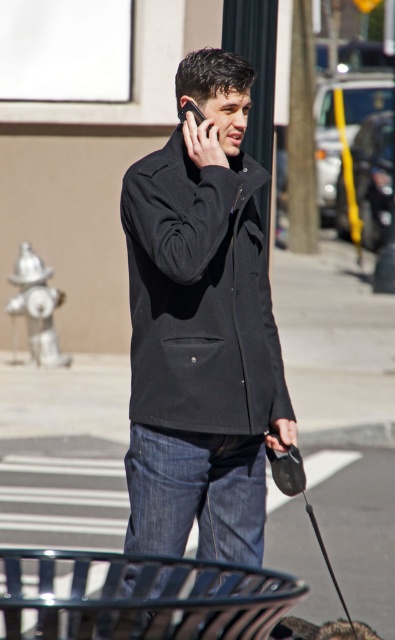
You are a delivery person who needs to deliver a package to the address on the tree trunk nearby. You see the black matte jacket at center and the silver metallic fire hydrant at lower left. Which object is closer to the ground?

The black matte jacket at center is located below silver metallic fire hydrant at lower left, so the black matte jacket at center is closer to the ground.

You are a pedestrian passing by the man in the scene. You notice the black matte jacket at center and the matte black phone at upper center. Which object is positioned to the right of the other?

The black matte jacket at center is to the right of the matte black phone at upper center.

You are a delivery person who needs to deliver a package to the beige building wall with a window. You are currently standing at the point marked as point (26, 289). The distance between you and the beige building wall with a window is 14.06 meters. Can you walk straight to the beige building wall with a window without any obstacles?

The distance between point (26, 289) and the beige building wall with a window is 14.06 meters. Since there are no obstacles mentioned in the scene description, you can walk straight to the beige building wall with a window without any issues.